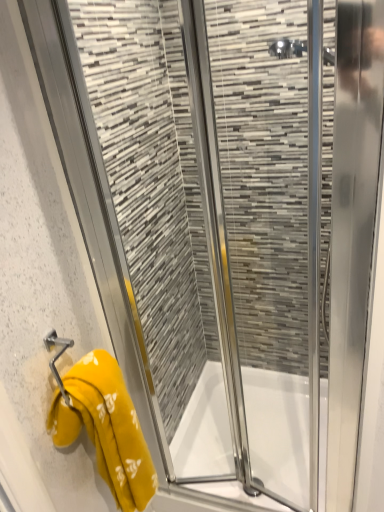
Question: From a real-world perspective, relative to white glossy bath at center, is yellow fabric towel at left vertically above or below?

Choices:
 (A) above
 (B) below

Answer: (A)

Question: Considering the positions of yellow fabric towel at left and white glossy bath at center in the image, is yellow fabric towel at left taller or shorter than white glossy bath at center?

Choices:
 (A) tall
 (B) short

Answer: (A)

Question: From the image's perspective, is yellow fabric towel at left above or below white glossy bath at center?

Choices:
 (A) below
 (B) above

Answer: (B)

Question: Considering the positions of white glossy bath at center and yellow fabric towel at left in the image, is white glossy bath at center taller or shorter than yellow fabric towel at left?

Choices:
 (A) tall
 (B) short

Answer: (B)

Question: Does point (218, 468) appear closer or farther from the camera than point (110, 364)?

Choices:
 (A) closer
 (B) farther

Answer: (B)

Question: Considering the relative positions of white glossy bath at center and yellow fabric towel at left in the image provided, is white glossy bath at center to the left or to the right of yellow fabric towel at left?

Choices:
 (A) left
 (B) right

Answer: (B)

Question: From a real-world perspective, relative to yellow fabric towel at left, is white glossy bath at center vertically above or below?

Choices:
 (A) below
 (B) above

Answer: (A)